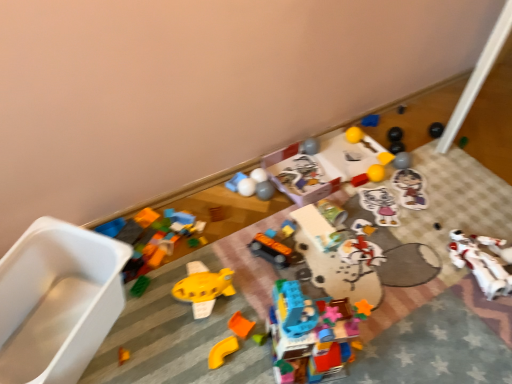
At what (x,y) coordinates should I click in order to perform the action: click on free space between matte black car at center, the eighth toy positioned from the left, and yellow matte toy boat at center, which ranks as the 16th toy in right-to-left order. Please return your answer as a coordinate pair (x, y). The image size is (512, 384). Looking at the image, I should click on (244, 273).